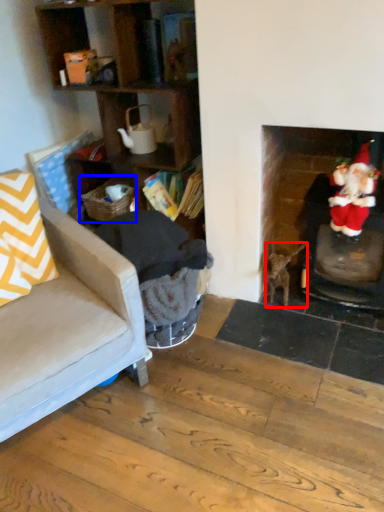
Question: Among these objects, which one is nearest to the camera, animal (highlighted by a red box) or laundry basket (highlighted by a blue box)?

Choices:
 (A) animal
 (B) laundry basket

Answer: (A)